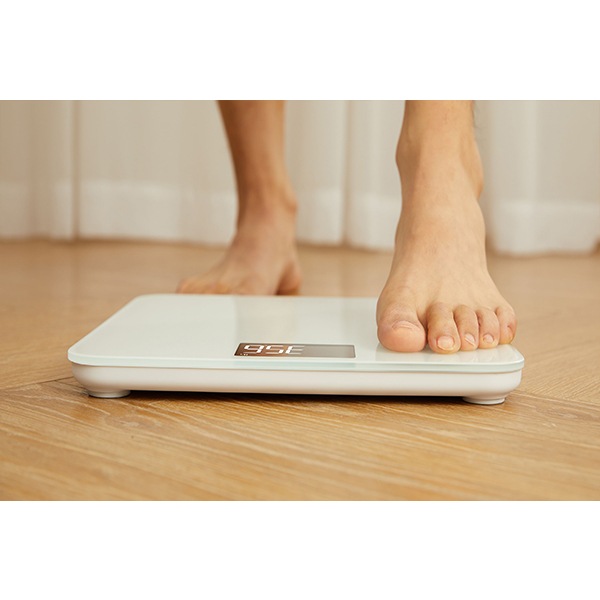
Find the location of a particular element. The width and height of the screenshot is (600, 600). white bathroom scale is located at coordinates (100, 345).